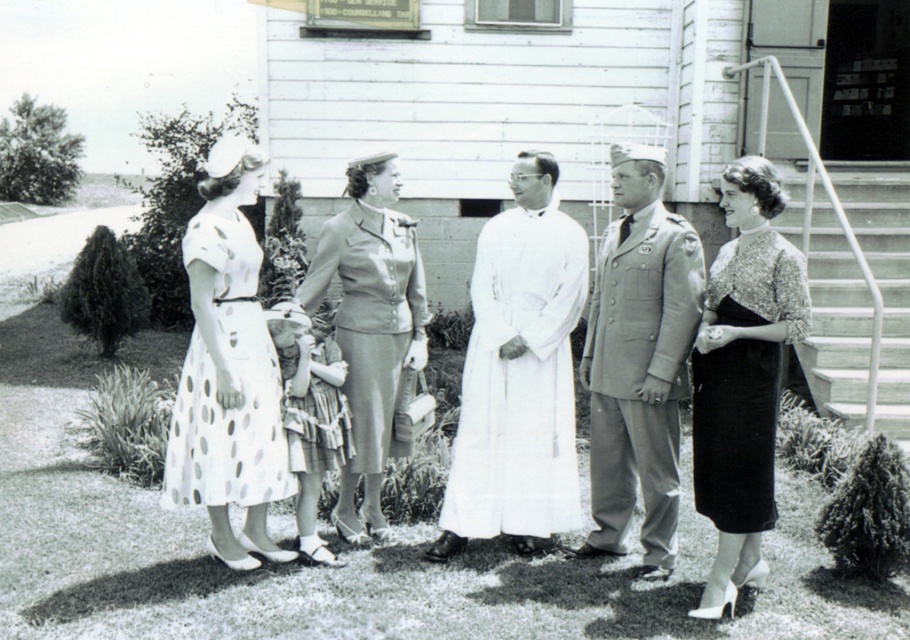
Question: Which object appears closest to the camera in this image?

Choices:
 (A) shiny black dress at right
 (B) white dotted fabric dress at left

Answer: (A)

Question: Which point appears closest to the camera in this image?

Choices:
 (A) (228, 474)
 (B) (342, 300)
 (C) (672, 236)
 (D) (543, 417)

Answer: (A)

Question: Which of the following is the closest to the observer?

Choices:
 (A) shiny black dress at right
 (B) white cloth robe at center
 (C) matte gray suit at center
 (D) white dotted fabric dress at left

Answer: (A)

Question: Is light gray uniform at center positioned behind shiny black dress at right?

Choices:
 (A) no
 (B) yes

Answer: (B)

Question: Does white cloth robe at center have a smaller size compared to shiny black dress at right?

Choices:
 (A) no
 (B) yes

Answer: (A)

Question: Can you confirm if white cloth robe at center is thinner than light gray uniform at center?

Choices:
 (A) yes
 (B) no

Answer: (B)